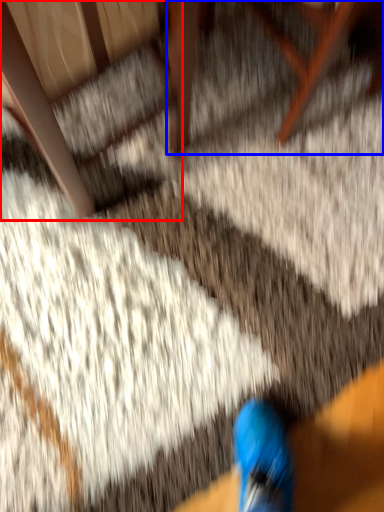
Question: Which of the following is the closest to the observer, armchair (highlighted by a red box) or furniture (highlighted by a blue box)?

Choices:
 (A) armchair
 (B) furniture

Answer: (A)